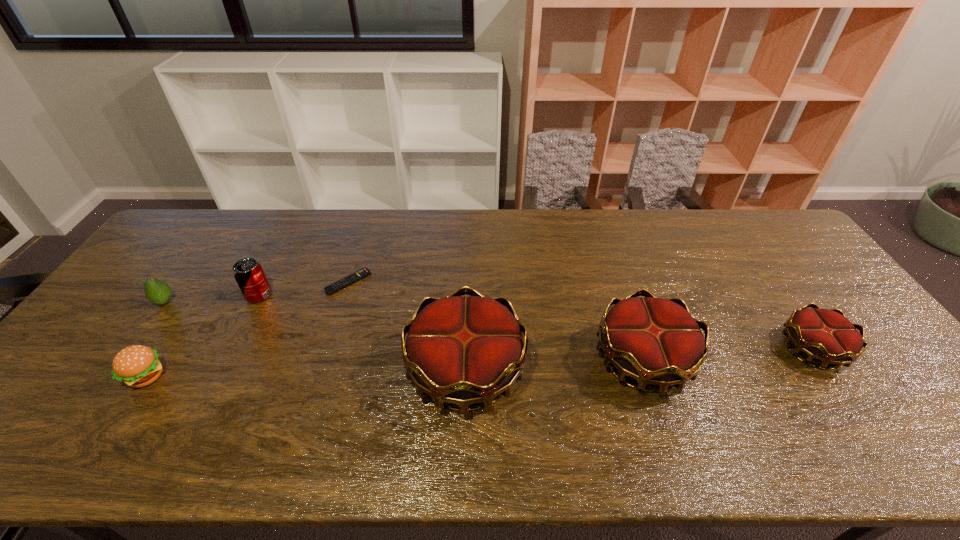
In order to click on the fifth object from right to left in this screenshot , I will do `click(248, 273)`.

Find the location of a particular element. free location located 0.350m on the right of the leftmost crown is located at coordinates (664, 370).

You are a GUI agent. You are given a task and a screenshot of the screen. Output one action in this format:
    pyautogui.click(x=<x>, y=<y>)
    Task: Click on the free space located 0.350m on the back of the second crown from left to right
    This screenshot has width=960, height=540.
    Given the screenshot: What is the action you would take?
    pyautogui.click(x=605, y=243)

At what (x,y) coordinates should I click in order to perform the action: click on vacant area situated 0.300m on the left of the rightmost object. Please return your answer as a coordinate pair (x, y). The image size is (960, 540). Looking at the image, I should click on (666, 349).

Image resolution: width=960 pixels, height=540 pixels. I want to click on free space located on the right of the leftmost object, so 292,302.

Locate an element on the screen. This screenshot has width=960, height=540. vacant region located 0.290m on the front of the remote control is located at coordinates (318, 379).

Locate an element on the screen. free space located 0.210m on the back of the hamburger is located at coordinates (196, 300).

At what (x,y) coordinates should I click in order to perform the action: click on vacant region located 0.380m on the right of the third tallest object. Please return your answer as a coordinate pair (x, y). This screenshot has width=960, height=540. Looking at the image, I should click on (400, 295).

This screenshot has width=960, height=540. In order to click on hamburger that is at the near edge in this screenshot , I will do `click(137, 366)`.

The image size is (960, 540). What are the coordinates of `object at the left edge` in the screenshot? It's located at (158, 292).